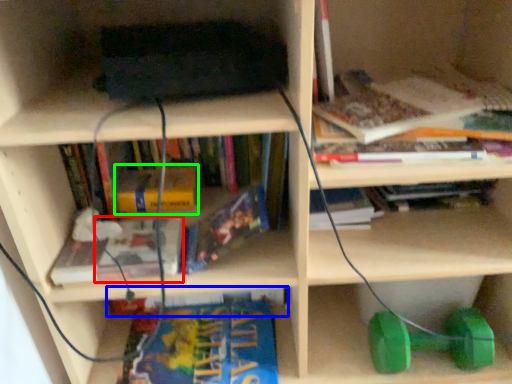
Question: Considering the real-world distances, which object is closest to book (highlighted by a red box)? book (highlighted by a blue box) or book (highlighted by a green box).

Choices:
 (A) book
 (B) book

Answer: (B)